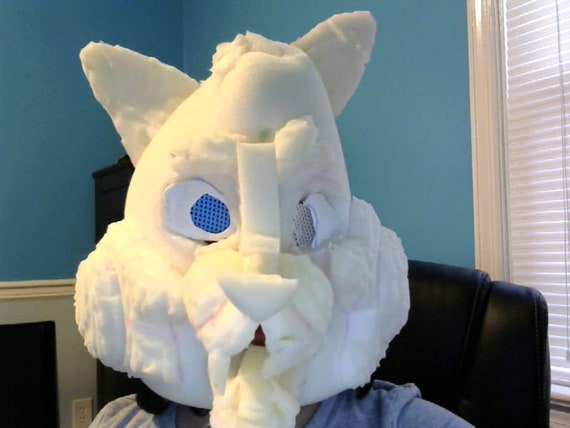
Find the location of a particular element. The height and width of the screenshot is (428, 570). wall is located at coordinates click(384, 135), click(27, 140).